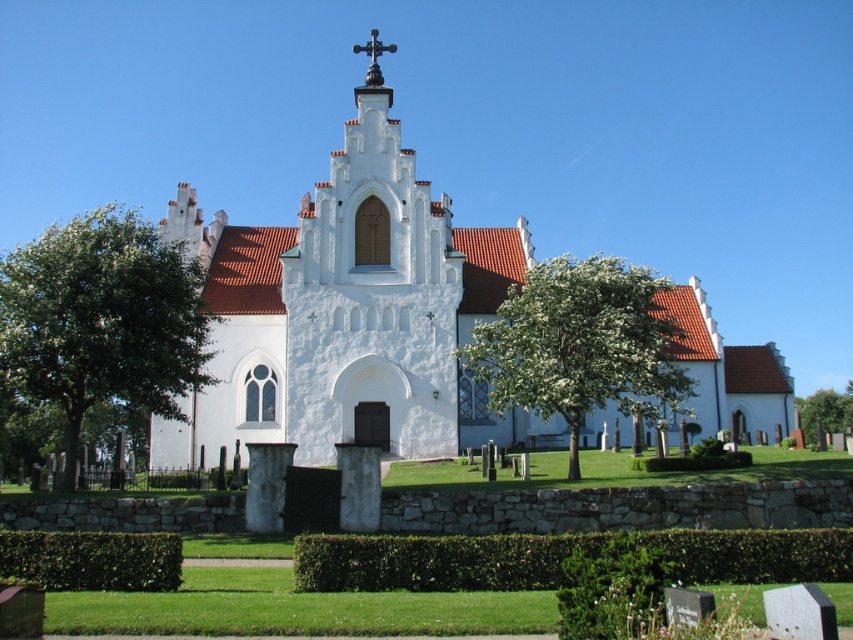
You are standing in front of the church and want to walk from the green leafy hedge at lower left to the green leafy tree at center. Which direction should you move?

You should move to the right because the green leafy hedge at lower left is positioned on the left side of the green leafy tree at center, meaning the tree is to the right of the hedge.

You are a landscape architect designing a new garden layout. You need to place a new statue exactly between the white stucco church at center and the green leafy hedge at lower left. Given their sizes, which object will the statue be closer to?

The statue will be closer to the green leafy hedge at lower left because the white stucco church at center is wider than the green leafy hedge at lower left, so the midpoint between them would be nearer to the smaller object.

You are standing in front of the church and want to take a photo of the green leafy hedge at lower left. Where should you position yourself to capture it in the frame?

You should position yourself to the right side of the church to capture the green leafy hedge at lower left in the frame since it is located at point (91,561) which is on the lower left side of the image.